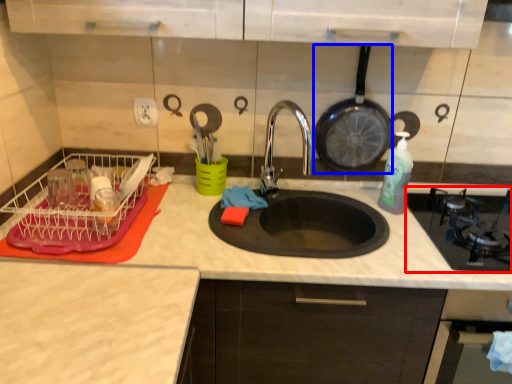
Question: Which of the following is the closest to the observer, gas stove (highlighted by a red box) or frying pan (highlighted by a blue box)?

Choices:
 (A) gas stove
 (B) frying pan

Answer: (A)